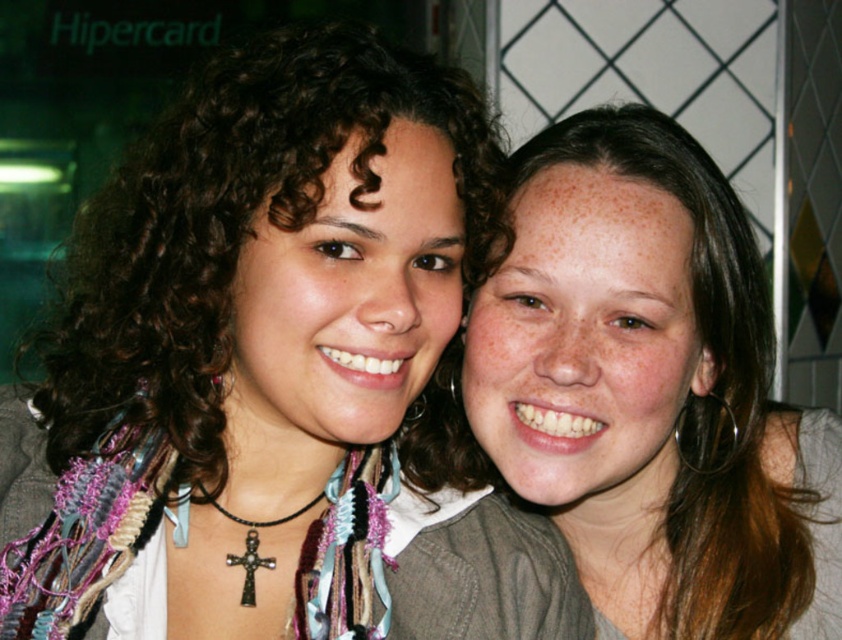
Question: Does light brown hair at center have a lesser width compared to black metallic cross at center?

Choices:
 (A) yes
 (B) no

Answer: (B)

Question: Which of the following is the closest to the observer?

Choices:
 (A) (158, 292)
 (B) (256, 525)
 (C) (765, 285)

Answer: (A)

Question: Considering the relative positions of matte black necklace at center and light brown hair at center in the image provided, where is matte black necklace at center located with respect to light brown hair at center?

Choices:
 (A) left
 (B) right

Answer: (A)

Question: Can you confirm if light brown hair at center is wider than black metallic cross at center?

Choices:
 (A) no
 (B) yes

Answer: (B)

Question: Which object is positioned closest to the light brown hair at center?

Choices:
 (A) black metallic cross at center
 (B) matte black necklace at center

Answer: (B)

Question: Estimate the real-world distances between objects in this image. Which object is farther from the light brown hair at center?

Choices:
 (A) black metallic cross at center
 (B) matte black necklace at center

Answer: (A)